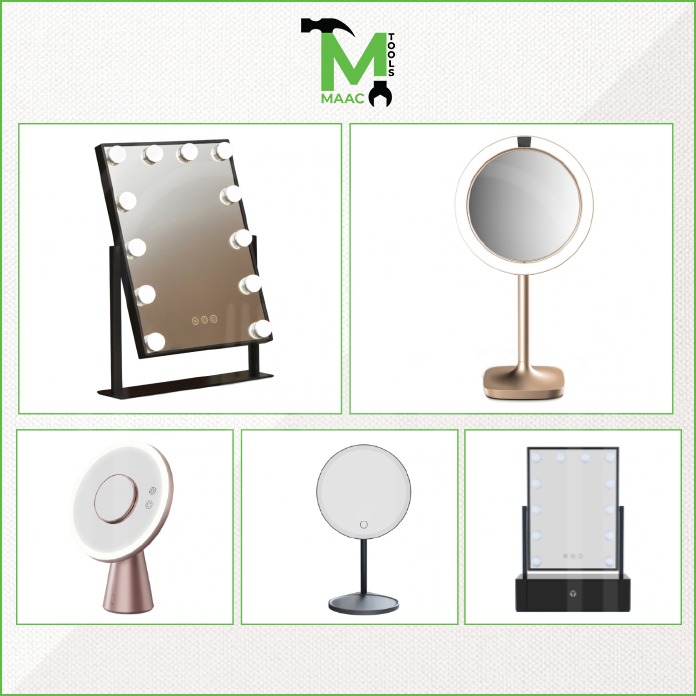
At what (x,y) coordinates should I click in order to perform the action: click on round mirror with bar light surrounding edges. Please return your answer as a coordinate pair (x, y). This screenshot has width=696, height=696. Looking at the image, I should click on (527, 214).